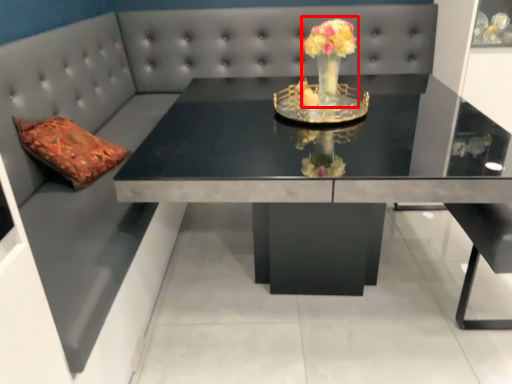
Question: Considering the relative positions of floral arrangement (annotated by the red box) and table in the image provided, where is floral arrangement (annotated by the red box) located with respect to the staircase?

Choices:
 (A) right
 (B) left

Answer: (A)